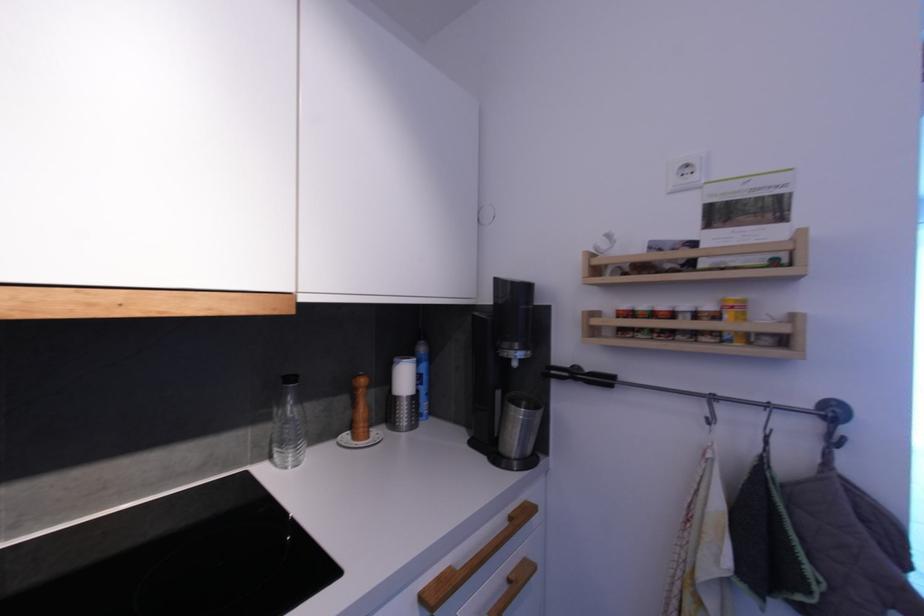
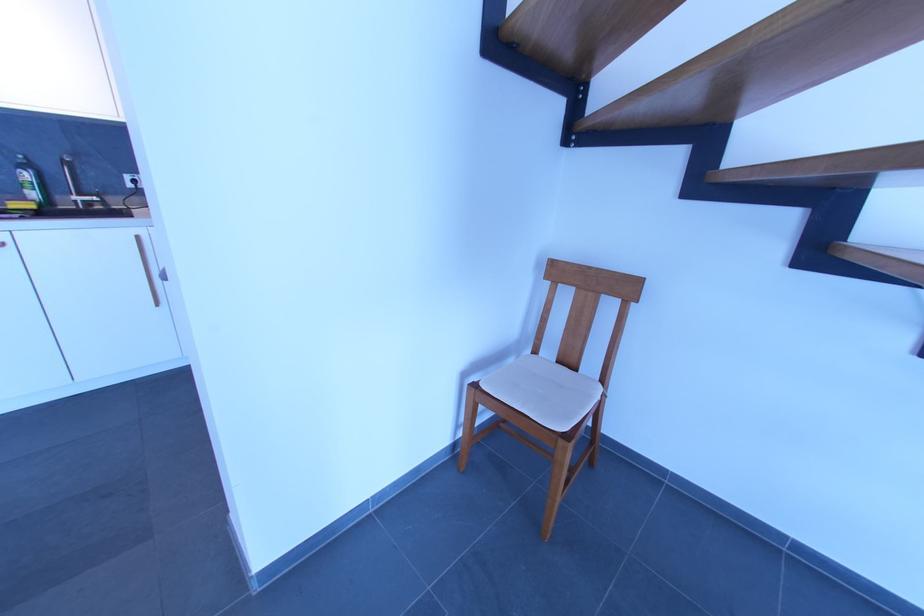
Question: I am providing you with two images of the same scene from different viewpoints. Which of the following objects are not visible in image2?

Choices:
 (A) small spice jar
 (B) green drinking glass
 (C) chair sitting surface
 (D) faucet handle

Answer: (A)